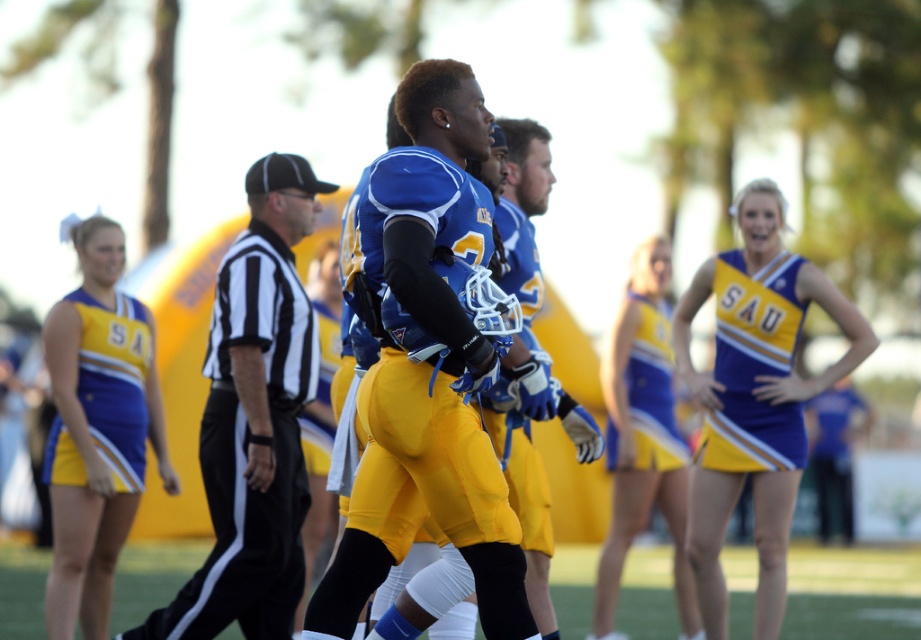
You are a photographer trying to capture the exact location of the point at coordinates point (254, 420) in the image. Based on the scene description, which object is this point located on?

The point (254, 420) is on the black and white striped shirt at center.

You are a photographer at the football field. You need to capture a photo that includes both the matte yellow cheerleading outfit at left and the yellow satin skirt at right. Which object should be placed closer to the camera to ensure both are in focus?

The matte yellow cheerleading outfit at left is not as tall as the yellow satin skirt at right. To ensure both are in focus, the shorter matte yellow cheerleading outfit at left should be placed closer to the camera so that the distance between them is minimized.

You are a photographer at the football field. You need to take a photo of the matte blue jersey at center and the black and white striped shirt at center. Which one will appear larger in the photo?

The black and white striped shirt at center will appear larger in the photo because it has a bigger size than the matte blue jersey at center.